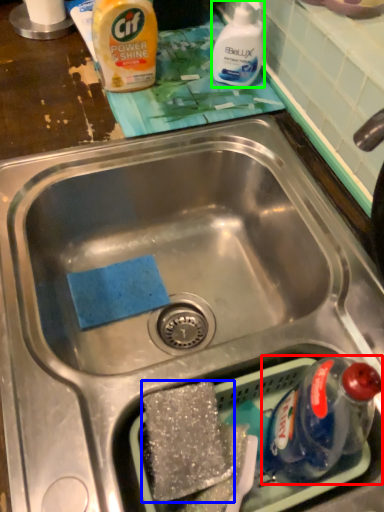
Question: Considering the real-world distances, which object is closest to bottle (highlighted by a red box)? food (highlighted by a blue box) or cleaning product (highlighted by a green box).

Choices:
 (A) food
 (B) cleaning product

Answer: (A)